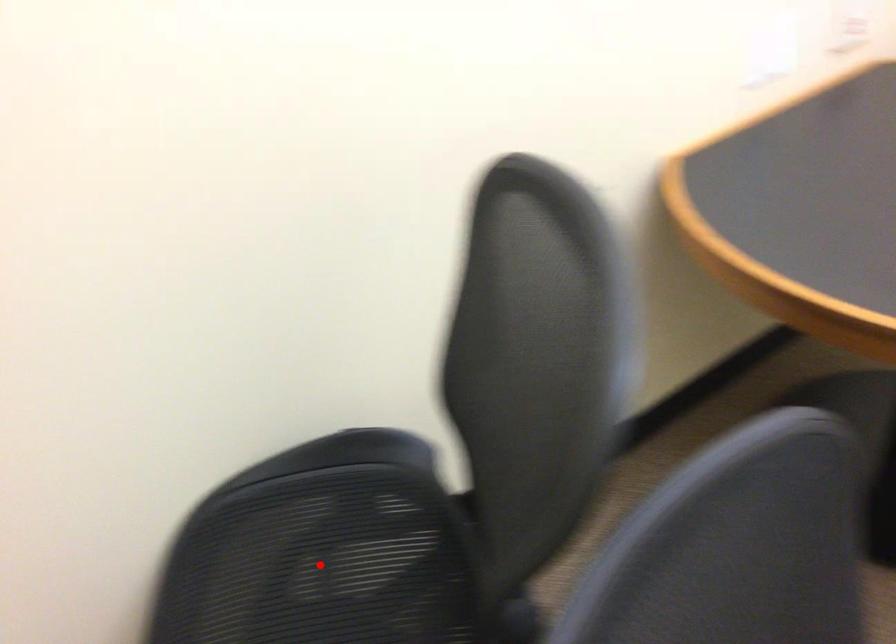
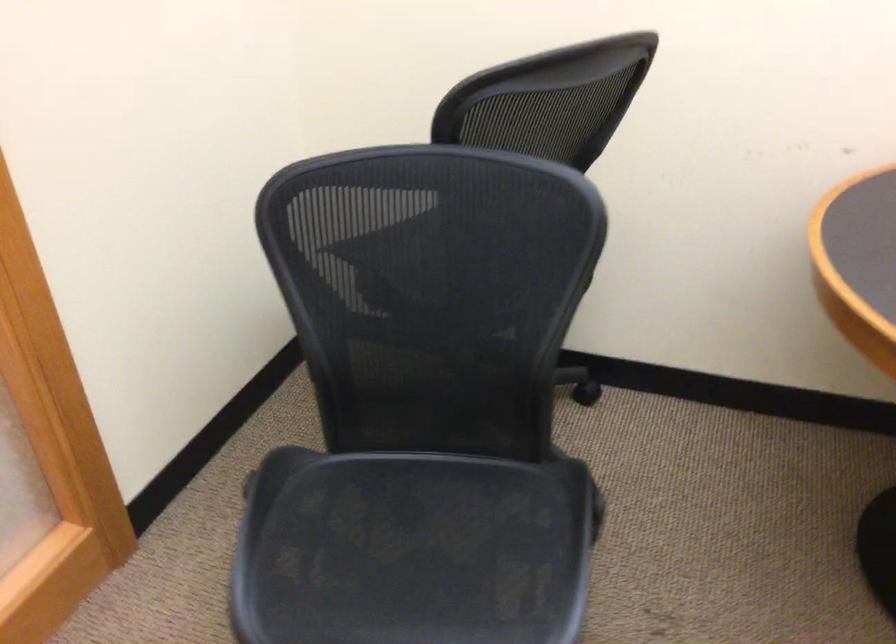
Question: I am providing you with two images of the same scene from different viewpoints. A red point is marked on the first image. Is the red point's position out of view in image 2?

Choices:
 (A) Yes
 (B) No

Answer: (A)